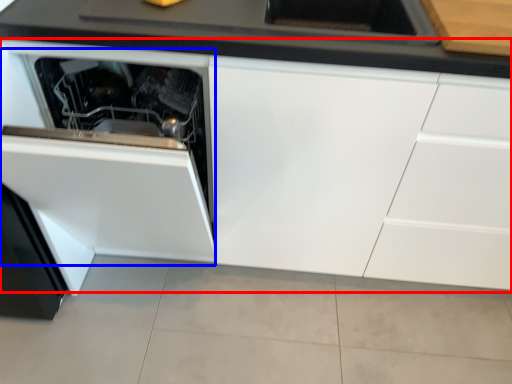
Question: Which of the following is the farthest to the observer, cabinetry (highlighted by a red box) or oven (highlighted by a blue box)?

Choices:
 (A) cabinetry
 (B) oven

Answer: (A)